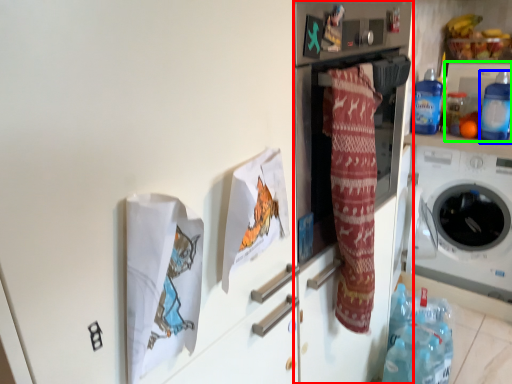
Question: Which object is positioned farthest from fridge (highlighted by a red box)? Select from bottle (highlighted by a blue box) and appliance (highlighted by a green box).

Choices:
 (A) bottle
 (B) appliance

Answer: (B)